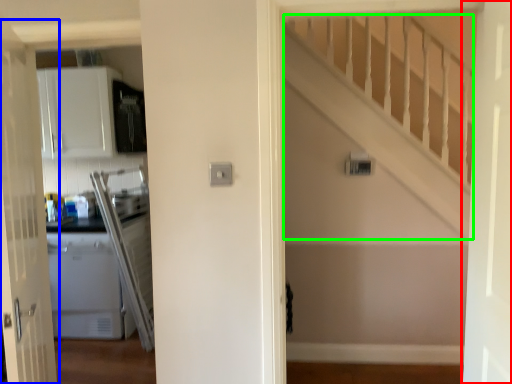
Question: Based on their relative distances, which object is nearer to door (highlighted by a red box)? Choose from door (highlighted by a blue box) and stairwell (highlighted by a green box).

Choices:
 (A) door
 (B) stairwell

Answer: (B)